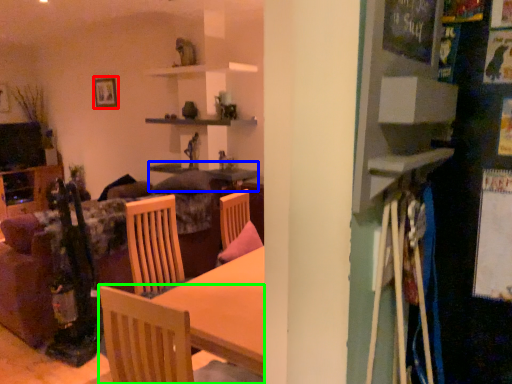
Question: Which is nearer to the picture frame (highlighted by a red box)? table (highlighted by a blue box) or chair (highlighted by a green box).

Choices:
 (A) table
 (B) chair

Answer: (A)